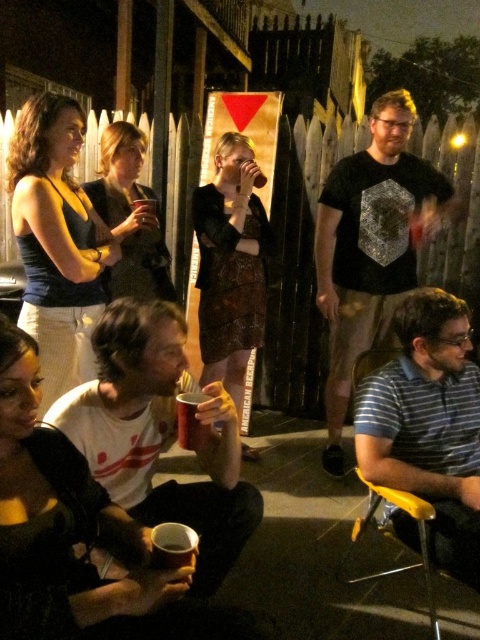
You are standing at the entrance of the event and want to move towards the two points marked in the image. Which point, point (338, 285) or point (173, 563), will you reach first?

Point (338, 285) is further to the viewer than point (173, 563), so you will reach point (338, 285) first.

You are a guest at this event and want to place your metallic silver cup at lower center on the yellow plastic chair at lower right. Considering the distance between them, do you think you can easily reach the cup from the chair without moving your position?

Answer: The yellow plastic chair at lower right is 30.03 inches away from the metallic silver cup at lower center. Since this distance is within a comfortable arm reach for most people, you can easily reach the metallic silver cup at lower center from the yellow plastic chair at lower right without needing to move your position.